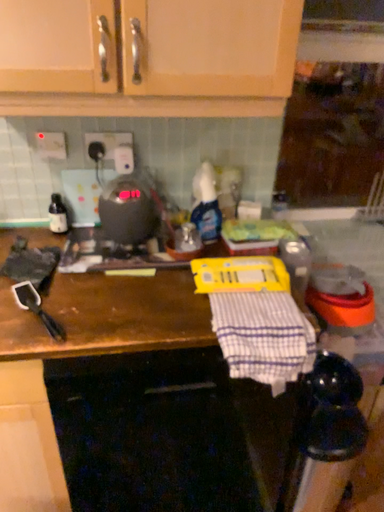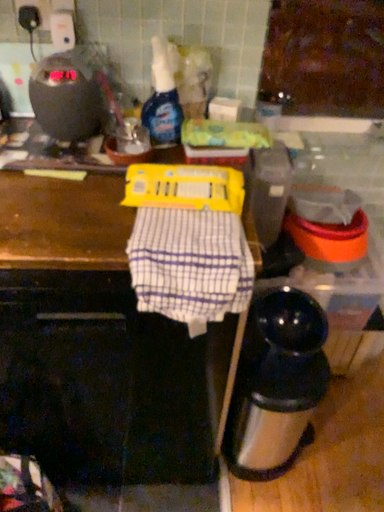
Question: Which way did the camera rotate in the video?

Choices:
 (A) rotated downward
 (B) rotated upward

Answer: (A)